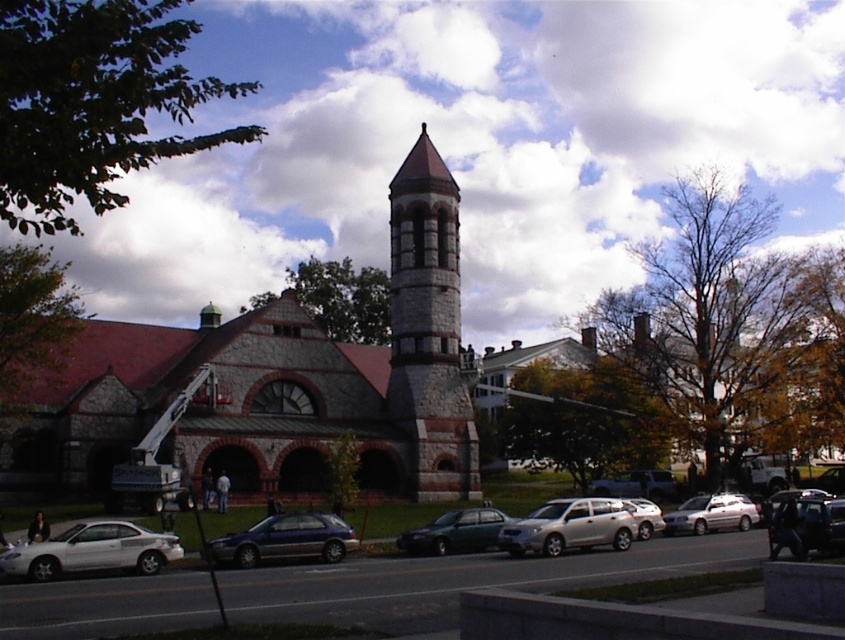
You are standing in front of the historic stone building and want to locate the stone tower at center. According to the coordinates given, where should you look to find it?

The stone tower at center is located at coordinates point (x=276, y=381).

You are a delivery person trying to park your van near the historic stone building. You see the stone tower at center and the metallic green sedan at center. Which object is positioned higher from the ground?

The stone tower at center is located above the metallic green sedan at center, so it is positioned higher from the ground.